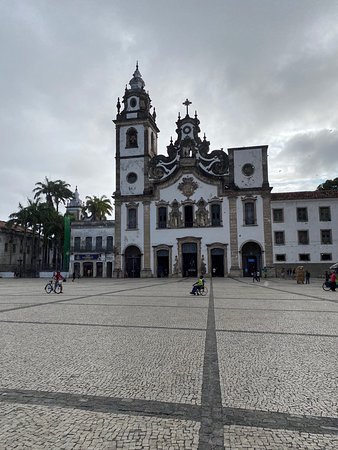
Locate an element on the screen. The height and width of the screenshot is (450, 338). window is located at coordinates (278, 234).